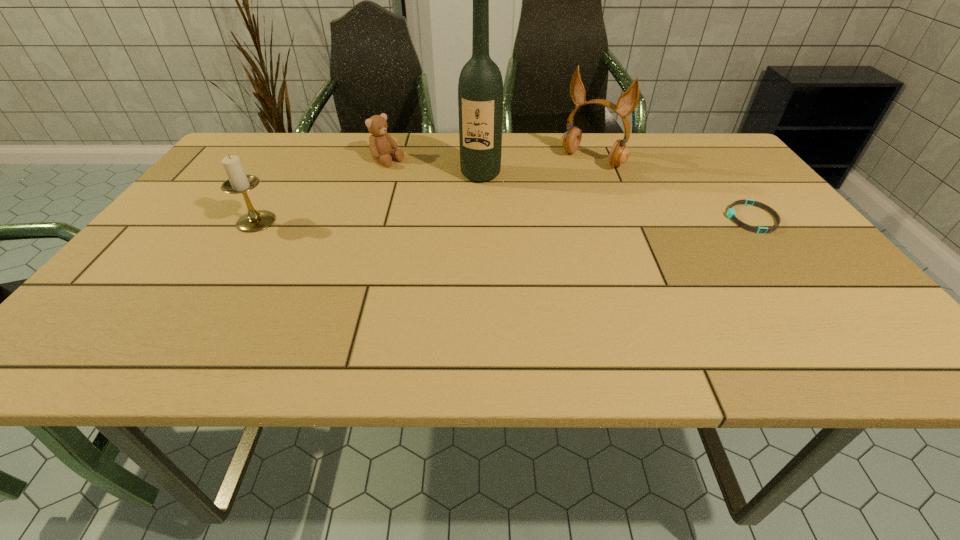
In order to click on vacant space at the right edge in this screenshot , I will do `click(697, 173)`.

The width and height of the screenshot is (960, 540). Find the location of `vacant region at the far right corner`. vacant region at the far right corner is located at coordinates (729, 156).

The image size is (960, 540). Find the location of `blank area at the near right corner`. blank area at the near right corner is located at coordinates (857, 319).

I want to click on unoccupied position between the shortest object and the third object from right to left, so click(x=616, y=197).

This screenshot has width=960, height=540. Find the location of `vacant space that's between the fourth object from left to right and the tallest object`. vacant space that's between the fourth object from left to right and the tallest object is located at coordinates (537, 167).

Identify the location of vacant space that is in between the rightmost object and the candle holder. The height and width of the screenshot is (540, 960). (504, 220).

Where is `unoccupied area between the rightmost object and the third shortest object`? Image resolution: width=960 pixels, height=540 pixels. unoccupied area between the rightmost object and the third shortest object is located at coordinates (504, 220).

This screenshot has height=540, width=960. Find the location of `free spot between the third object from left to right and the shortest object`. free spot between the third object from left to right and the shortest object is located at coordinates (616, 197).

Locate an element on the screen. vacant space that's between the third object from left to right and the fourth object from left to right is located at coordinates (537, 167).

The image size is (960, 540). In order to click on vacant area between the leftmost object and the tallest object in this screenshot , I will do `click(369, 198)`.